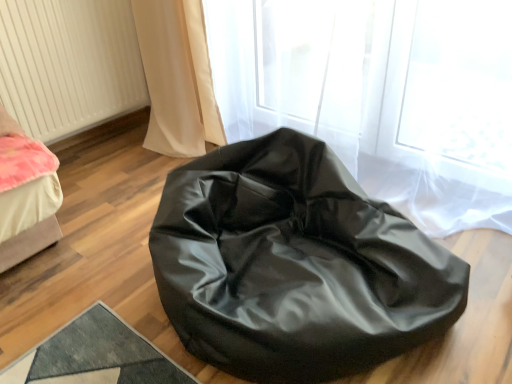
This screenshot has height=384, width=512. Describe the element at coordinates (68, 64) in the screenshot. I see `white textured radiator at left` at that location.

The image size is (512, 384). What are the coordinates of `white textured radiator at left` in the screenshot? It's located at (68, 64).

This screenshot has width=512, height=384. Describe the element at coordinates (295, 265) in the screenshot. I see `glossy black bean bag at center` at that location.

At what (x,y) coordinates should I click in order to perform the action: click on glossy black bean bag at center. Please return your answer as a coordinate pair (x, y). The width and height of the screenshot is (512, 384). Looking at the image, I should click on (295, 265).

I want to click on white textured radiator at left, so click(x=68, y=64).

Based on their positions, is white textured radiator at left located to the left or right of glossy black bean bag at center?

In the image, white textured radiator at left appears on the left side of glossy black bean bag at center.

Relative to glossy black bean bag at center, is white textured radiator at left in front or behind?

In the image, white textured radiator at left appears behind glossy black bean bag at center.

Is point (64, 127) farther from viewer compared to point (232, 215)?

That is True.

From the image's perspective, is white textured radiator at left under glossy black bean bag at center?

No, from the image's perspective, white textured radiator at left is not below glossy black bean bag at center.

From a real-world perspective, is white textured radiator at left above or below glossy black bean bag at center?

white textured radiator at left is above glossy black bean bag at center.

Looking at their sizes, would you say white textured radiator at left is wider or thinner than glossy black bean bag at center?

In the image, white textured radiator at left appears to be more narrow than glossy black bean bag at center.

Considering the sizes of objects white textured radiator at left and glossy black bean bag at center in the image provided, who is taller, white textured radiator at left or glossy black bean bag at center?

With more height is white textured radiator at left.

Based on their sizes in the image, would you say white textured radiator at left is bigger or smaller than glossy black bean bag at center?

Considering their sizes, white textured radiator at left takes up less space than glossy black bean bag at center.

Is white textured radiator at left not inside glossy black bean bag at center?

Yes.

Are white textured radiator at left and glossy black bean bag at center beside each other?

There is a gap between white textured radiator at left and glossy black bean bag at center.

Is glossy black bean bag at center at the back of white textured radiator at left?

No.

How many degrees apart are the facing directions of white textured radiator at left and glossy black bean bag at center?

90 degrees.

Locate an element on the screen. The width and height of the screenshot is (512, 384). furniture below the white textured radiator at left (from a real-world perspective) is located at coordinates (295, 265).

Would you say glossy black bean bag at center is to the left or to the right of white textured radiator at left in the picture?

From the image, it's evident that glossy black bean bag at center is to the right of white textured radiator at left.

Which object is further away from the camera, glossy black bean bag at center or white textured radiator at left?

white textured radiator at left is further away from the camera.

Considering the positions of point (209, 275) and point (63, 113), is point (209, 275) closer or farther from the camera than point (63, 113)?

Point (209, 275).

From the image's perspective, between glossy black bean bag at center and white textured radiator at left, who is located below?

From the image's view, glossy black bean bag at center is below.

From a real-world perspective, which is physically below, glossy black bean bag at center or white textured radiator at left?

glossy black bean bag at center.

Which of these two, glossy black bean bag at center or white textured radiator at left, is wider?

Wider between the two is glossy black bean bag at center.

Between glossy black bean bag at center and white textured radiator at left, which one has more height?

white textured radiator at left is taller.

Between glossy black bean bag at center and white textured radiator at left, which one has larger size?

With larger size is glossy black bean bag at center.

Do you think glossy black bean bag at center is within white textured radiator at left, or outside of it?

glossy black bean bag at center is not enclosed by white textured radiator at left.

Is glossy black bean bag at center far away from white textured radiator at left?

glossy black bean bag at center is positioned a significant distance from white textured radiator at left.

Could you tell me if glossy black bean bag at center is facing white textured radiator at left?

No.

What's the angular difference between glossy black bean bag at center and white textured radiator at left's facing directions?

glossy black bean bag at center and white textured radiator at left are facing 90 degrees away from each other.

This screenshot has width=512, height=384. In order to click on radiator located above the glossy black bean bag at center (from a real-world perspective) in this screenshot , I will do `click(68, 64)`.

Identify the location of furniture on the right of the white textured radiator at left. This screenshot has width=512, height=384. (295, 265).

I want to click on radiator on the left of glossy black bean bag at center, so click(x=68, y=64).